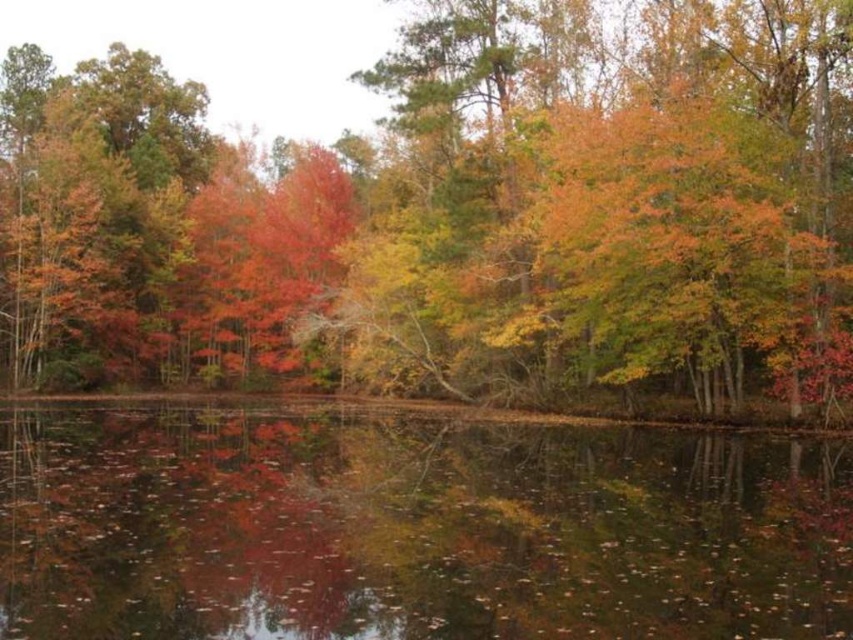
Question: Which point is closer to the camera taking this photo?

Choices:
 (A) (757, 496)
 (B) (350, 237)

Answer: (A)

Question: Considering the relative positions of autumn leaves at center and reflective dark water at center in the image provided, where is autumn leaves at center located with respect to reflective dark water at center?

Choices:
 (A) right
 (B) left

Answer: (B)

Question: Which point is closer to the camera taking this photo?

Choices:
 (A) (634, 518)
 (B) (164, 296)

Answer: (A)

Question: Does autumn leaves at center have a larger size compared to reflective dark water at center?

Choices:
 (A) no
 (B) yes

Answer: (B)

Question: Does autumn leaves at center come in front of reflective dark water at center?

Choices:
 (A) no
 (B) yes

Answer: (A)

Question: Which object appears farthest from the camera in this image?

Choices:
 (A) reflective dark water at center
 (B) autumn leaves at center

Answer: (B)